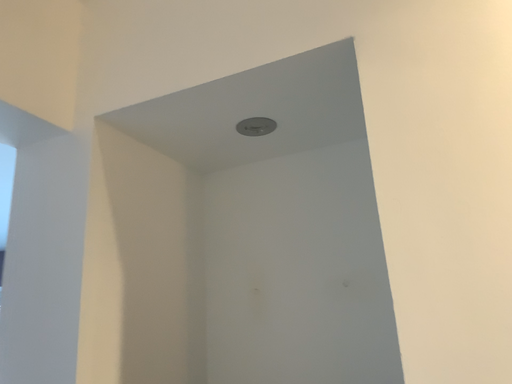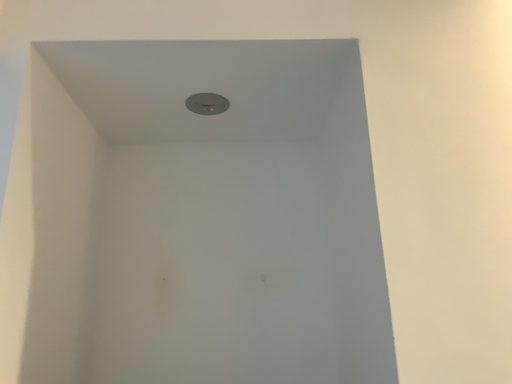
Question: How did the camera likely rotate when shooting the video?

Choices:
 (A) rotated left
 (B) rotated right

Answer: (B)